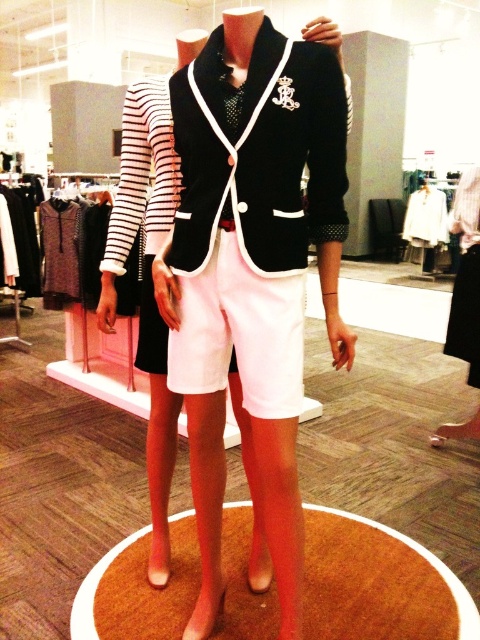
Does satin black blazer at center appear on the left side of white cotton shorts at center?

In fact, satin black blazer at center is to the right of white cotton shorts at center.

Is satin black blazer at center shorter than white cotton shorts at center?

Incorrect, satin black blazer at center's height does not fall short of white cotton shorts at center's.

Find the location of a particular element. satin black blazer at center is located at coordinates (252, 275).

Find the location of `satin black blazer at center`. satin black blazer at center is located at coordinates pos(252,275).

Between satin black blazer at center and velvet black blazer at center, which one appears on the right side from the viewer's perspective?

satin black blazer at center

Between satin black blazer at center and velvet black blazer at center, which one appears on the left side from the viewer's perspective?

From the viewer's perspective, velvet black blazer at center appears more on the left side.

The height and width of the screenshot is (640, 480). What are the coordinates of `satin black blazer at center` in the screenshot? It's located at (252, 275).

Who is more distant from viewer, (320,209) or (195,340)?

Positioned behind is point (195,340).

Is velvet black blazer at center in front of white cotton shorts at center?

Yes, velvet black blazer at center is closer to the viewer.

What do you see at coordinates (260, 154) in the screenshot?
I see `velvet black blazer at center` at bounding box center [260, 154].

Image resolution: width=480 pixels, height=640 pixels. I want to click on velvet black blazer at center, so pyautogui.click(x=260, y=154).